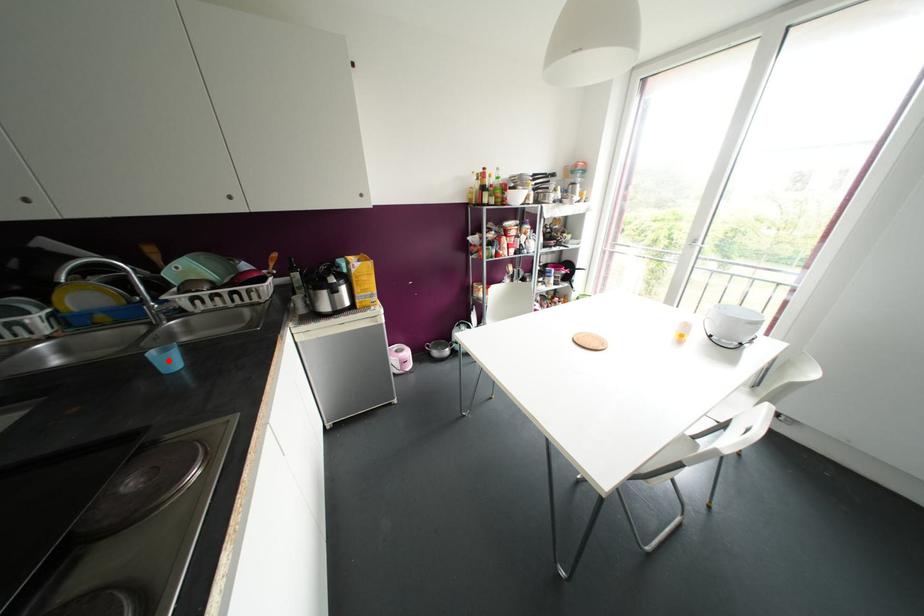
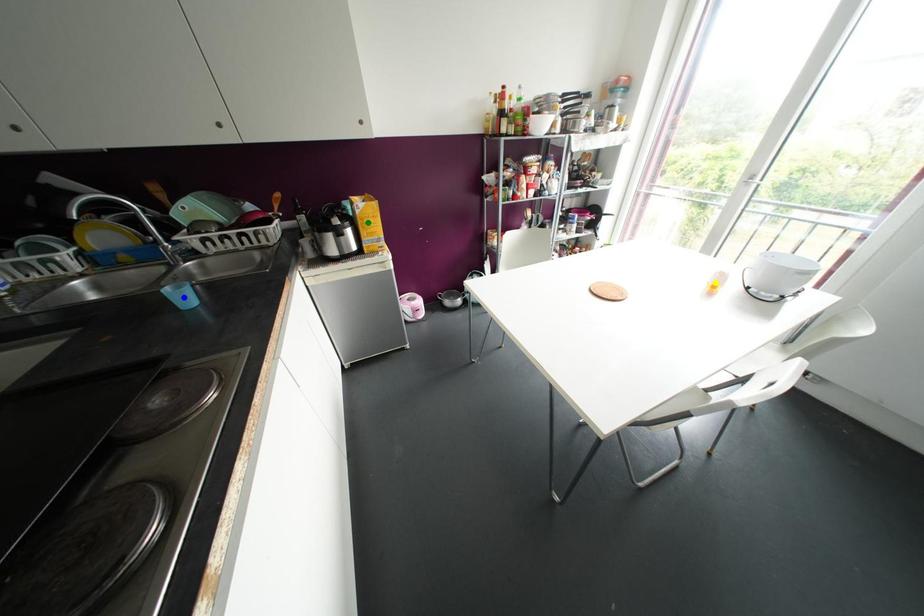
Question: I am providing you with two images of the same scene from different viewpoints. A red point is marked on the first image. You are given multiple points on the second image. Which point in image 2 is actually the same real-world point as the red point in image 1?

Choices:
 (A) green point
 (B) blue point
 (C) yellow point

Answer: (B)